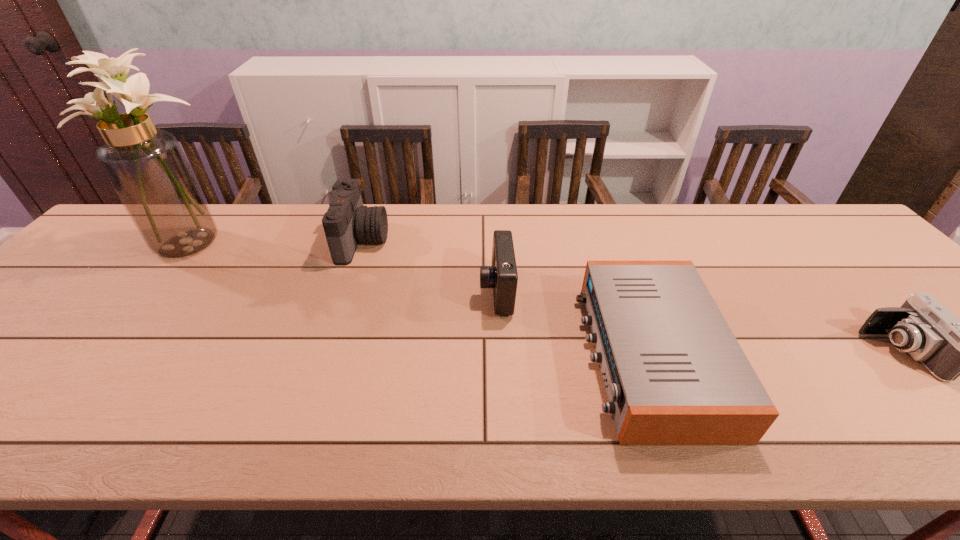
Where is `camera object that ranks as the closest to the fourth object from left to right`? The image size is (960, 540). camera object that ranks as the closest to the fourth object from left to right is located at coordinates (502, 276).